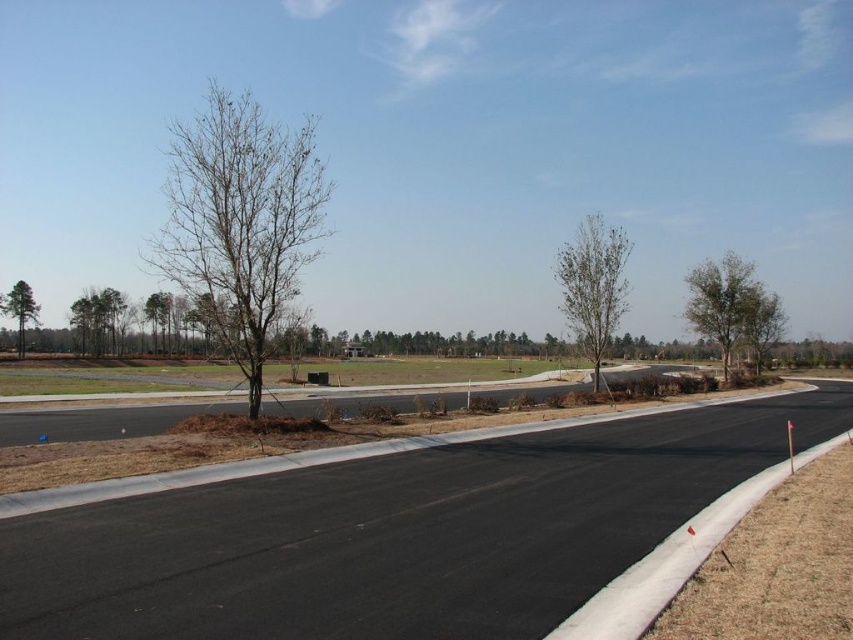
Question: Which point is closer to the camera?

Choices:
 (A) bare branches at left
 (B) black asphalt highway at center

Answer: (B)

Question: Does bare branches at left have a lesser width compared to bare wood tree at center?

Choices:
 (A) yes
 (B) no

Answer: (B)

Question: Which point is farther to the camera?

Choices:
 (A) green leafy tree at right
 (B) bare wood tree at left
 (C) bare branches at left
 (D) bare wood tree at center

Answer: (B)

Question: Which of the following is the closest to the observer?

Choices:
 (A) (579, 323)
 (B) (229, 221)
 (C) (376, 570)

Answer: (C)

Question: Does green leafy tree at right appear on the right side of bare wood tree at left?

Choices:
 (A) no
 (B) yes

Answer: (B)

Question: Does bare branches at left have a greater width compared to bare wood tree at left?

Choices:
 (A) yes
 (B) no

Answer: (A)